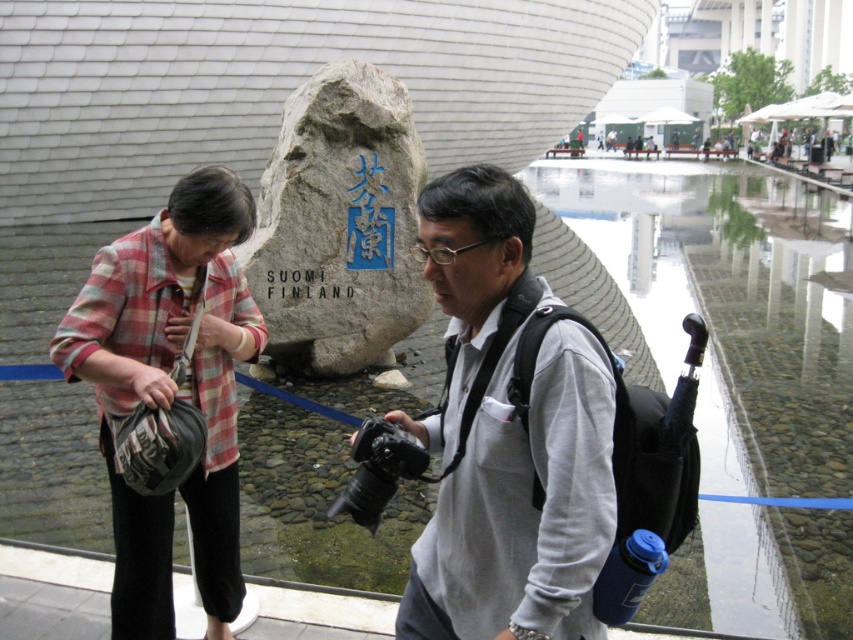
Consider the image. You are standing at the monument and want to take a photo of both the gray fabric camera at center and the other camera. Since the two cameras are 5.59 feet apart, will your smartphone camera with a 12mm lens be able to capture both in a single frame?

The two cameras are 5.59 feet apart. A smartphone camera with a 12mm lens typically has a field of view wide enough to capture objects at that distance in a single frame, so yes, it should be possible to include both the gray fabric camera at center and the other camera in one photo.

You are standing in the outdoor scene with the monument. You need to retrieve your jacket, which is the plaid fabric jacket at left, but there is a reflective water feature, the transparent plastic water at lower right, in the way. Can you step over the water to reach your jacket?

The transparent plastic water at lower right is located above the plaid fabric jacket at left, so you can step over the water since it is above and not blocking the path directly.

You are a photographer trying to capture the monument and the camera in the frame. Since both the gray fabric camera at center and the gray stone monument at center are in the scene, which one is positioned to the right of the other?

The gray fabric camera at center is to the right of the gray stone monument at center.